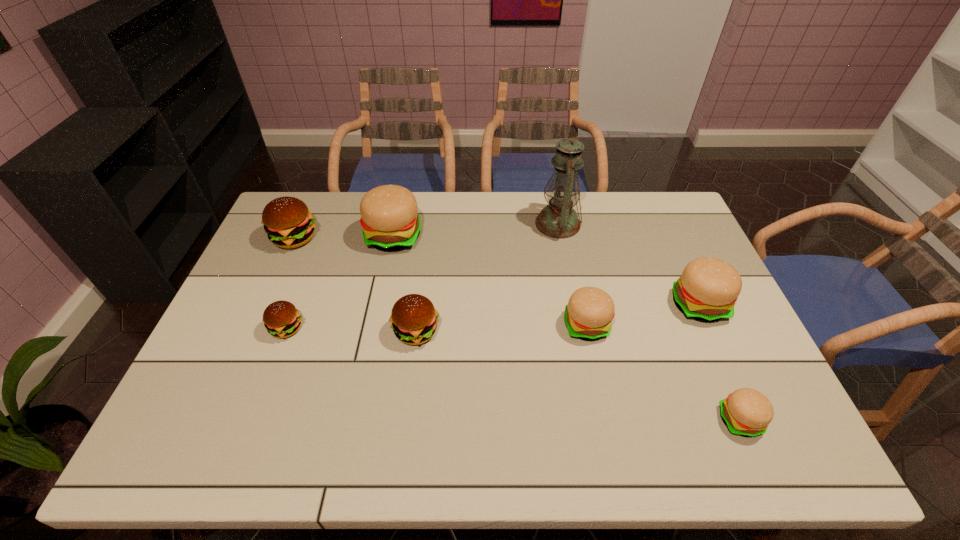
The width and height of the screenshot is (960, 540). I want to click on vacant region between the biggest beige hamburger and the second smallest brown hamburger, so click(x=405, y=284).

Locate an element on the screen. Image resolution: width=960 pixels, height=540 pixels. vacant area between the third biggest beige hamburger and the rightmost brown hamburger is located at coordinates (501, 328).

Find the location of a particular element. free area in between the rightmost brown hamburger and the biggest beige hamburger is located at coordinates (405, 284).

This screenshot has width=960, height=540. What are the coordinates of `empty location between the third smallest beige hamburger and the smallest brown hamburger` in the screenshot? It's located at (x=492, y=316).

At what (x,y) coordinates should I click in order to perform the action: click on free space between the oil lamp and the nearest object. Please return your answer as a coordinate pair (x, y). The image size is (960, 540). Looking at the image, I should click on pyautogui.click(x=649, y=322).

Locate an element on the screen. vacant space in between the oil lamp and the leftmost beige hamburger is located at coordinates (476, 230).

You are a GUI agent. You are given a task and a screenshot of the screen. Output one action in this format:
    pyautogui.click(x=<x>, y=<y>)
    Task: Click on the object that can be found as the fifth closest to the third smallest beige hamburger
    This screenshot has width=960, height=540.
    Given the screenshot: What is the action you would take?
    pyautogui.click(x=389, y=218)

Select which object appears as the closest to the second biggest brown hamburger. Please provide its 2D coordinates. Your answer should be formatted as a tuple, i.e. [(x, y)], where the tuple contains the x and y coordinates of a point satisfying the conditions above.

[(389, 218)]

Where is `the closest hamburger relative to the rightmost brown hamburger`? This screenshot has width=960, height=540. the closest hamburger relative to the rightmost brown hamburger is located at coordinates (389, 218).

Point out which hamburger is positioned as the nearest to the fifth hamburger from left to right. Please provide its 2D coordinates. Your answer should be formatted as a tuple, i.e. [(x, y)], where the tuple contains the x and y coordinates of a point satisfying the conditions above.

[(708, 288)]